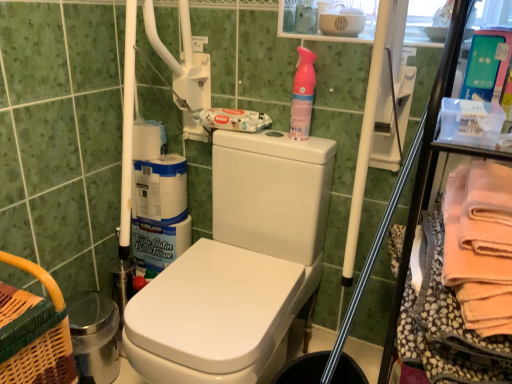
Question: Is the depth of pink plastic spray bottle at upper right greater than that of soft peach towel at right?

Choices:
 (A) no
 (B) yes

Answer: (B)

Question: Considering the relative sizes of pink plastic spray bottle at upper right and soft peach towel at right in the image provided, is pink plastic spray bottle at upper right taller than soft peach towel at right?

Choices:
 (A) no
 (B) yes

Answer: (A)

Question: Can you confirm if pink plastic spray bottle at upper right is bigger than soft peach towel at right?

Choices:
 (A) no
 (B) yes

Answer: (A)

Question: Can you confirm if pink plastic spray bottle at upper right is smaller than soft peach towel at right?

Choices:
 (A) no
 (B) yes

Answer: (B)

Question: Does pink plastic spray bottle at upper right have a lesser height compared to soft peach towel at right?

Choices:
 (A) no
 (B) yes

Answer: (B)

Question: Does pink plastic spray bottle at upper right have a greater width compared to soft peach towel at right?

Choices:
 (A) no
 (B) yes

Answer: (A)

Question: From a real-world perspective, is soft peach towel at right beneath pink plastic spray bottle at upper right?

Choices:
 (A) no
 (B) yes

Answer: (B)

Question: Can you confirm if soft peach towel at right is shorter than pink plastic spray bottle at upper right?

Choices:
 (A) yes
 (B) no

Answer: (B)

Question: Can you confirm if soft peach towel at right is smaller than pink plastic spray bottle at upper right?

Choices:
 (A) yes
 (B) no

Answer: (B)

Question: Is soft peach towel at right bigger than pink plastic spray bottle at upper right?

Choices:
 (A) yes
 (B) no

Answer: (A)

Question: Is soft peach towel at right in contact with pink plastic spray bottle at upper right?

Choices:
 (A) no
 (B) yes

Answer: (A)

Question: Does soft peach towel at right have a greater height compared to pink plastic spray bottle at upper right?

Choices:
 (A) no
 (B) yes

Answer: (B)

Question: Is pink plastic spray bottle at upper right inside or outside of soft peach towel at right?

Choices:
 (A) inside
 (B) outside

Answer: (B)